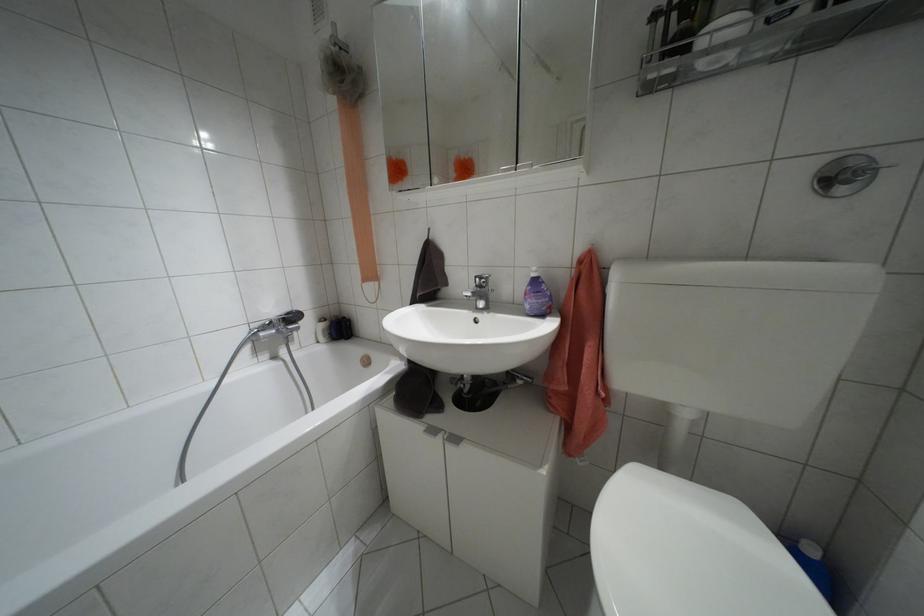
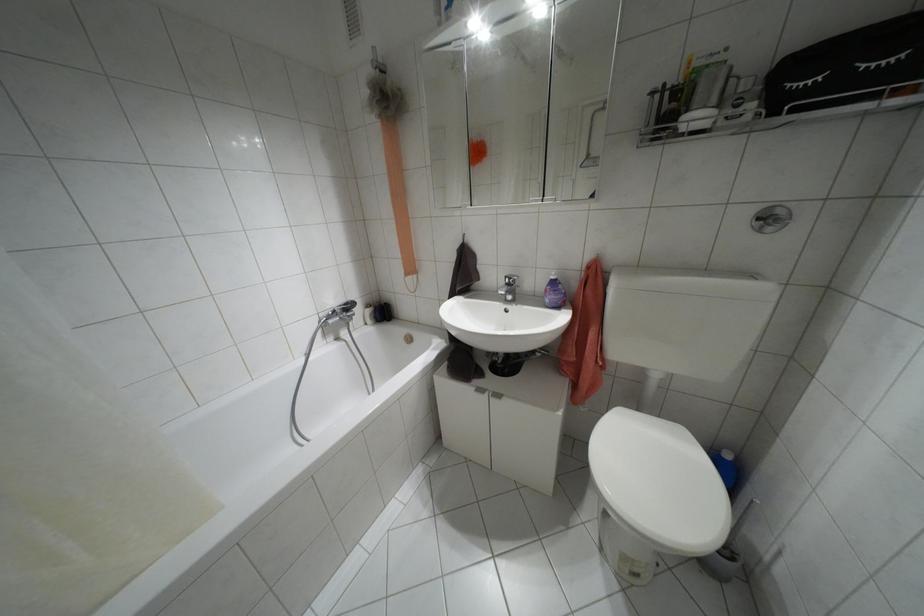
The point at (841, 190) is marked in the first image. Where is the corresponding point in the second image?

(769, 228)